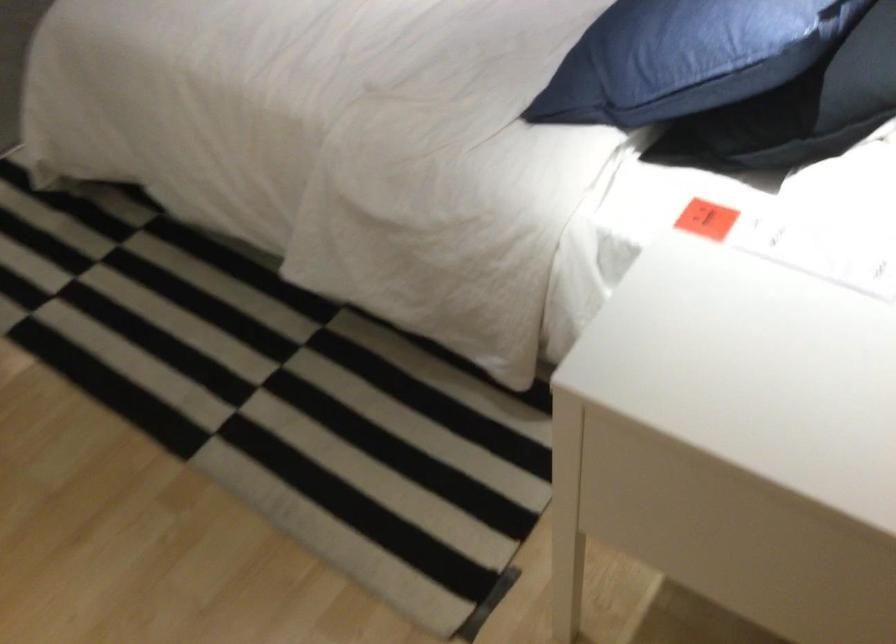
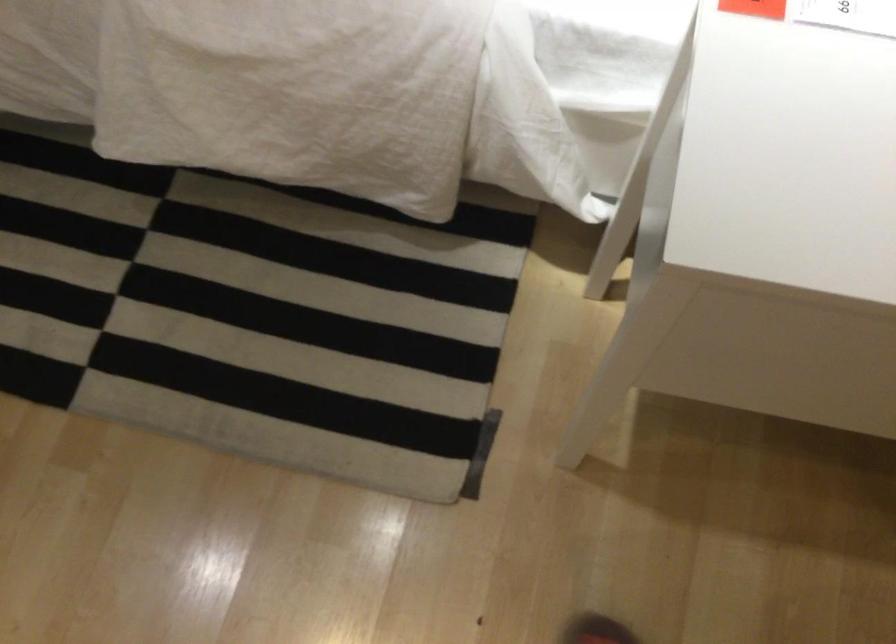
In a continuous first-person perspective shot, in which direction is the camera moving?

The cameraman walked toward left, forward.